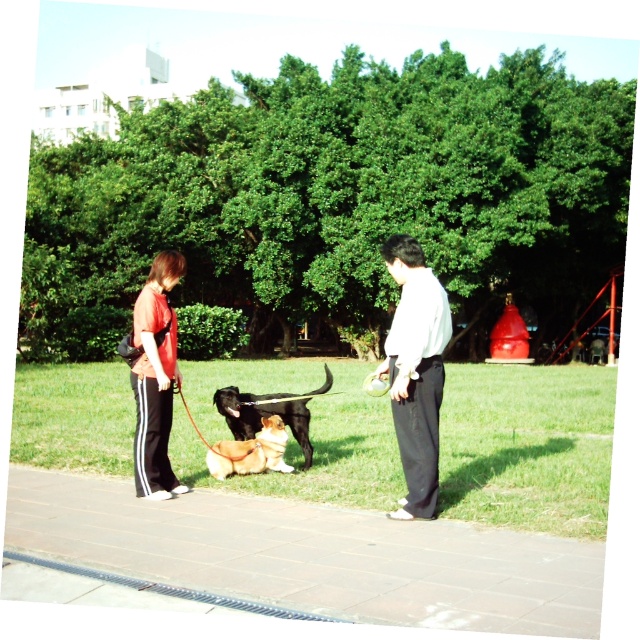
Is gray concrete pavement at lower center positioned behind shiny black dog at center?

No, it is not.

Between point (333, 586) and point (236, 440), which one is positioned behind?

Point (236, 440)

Is point (237, 572) closer to viewer compared to point (259, 417)?

Yes, point (237, 572) is closer to viewer.

Identify the location of gray concrete pavement at lower center. This screenshot has width=640, height=640. 316,554.

Which is more to the right, shiny black dog at center or brown plush dog at center?

From the viewer's perspective, shiny black dog at center appears more on the right side.

Is shiny black dog at center above brown plush dog at center?

Indeed, shiny black dog at center is positioned over brown plush dog at center.

Find the location of a particular element. shiny black dog at center is located at coordinates (264, 413).

Does matte red shirt at center appear under brown plush dog at center?

No, matte red shirt at center is not below brown plush dog at center.

Between matte red shirt at center and brown plush dog at center, which one appears on the left side from the viewer's perspective?

matte red shirt at center is more to the left.

The width and height of the screenshot is (640, 640). What are the coordinates of `matte red shirt at center` in the screenshot? It's located at (156, 378).

Locate an element on the screen. Image resolution: width=640 pixels, height=640 pixels. matte red shirt at center is located at coordinates (x=156, y=378).